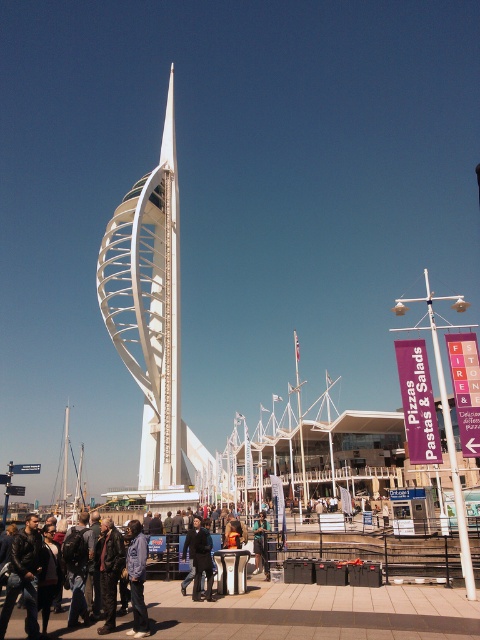
You are a photographer standing at the camera position. You want to take a closeup shot of the denim jacket at lower left. Can you estimate how far you need to walk towards the jacket to get it into focus?

The denim jacket at lower left is 51.20 meters away from the camera. To capture it in focus for a closeup, you would need to move closer to reduce the distance, but the exact required distance depends on your camera lens and focus settings.

In the scene shown: You are standing at the center of the image. Which direction should you move to reach the white metallic spire at center?

The white metallic spire at center is already at your current position since you are both at the center of the image.